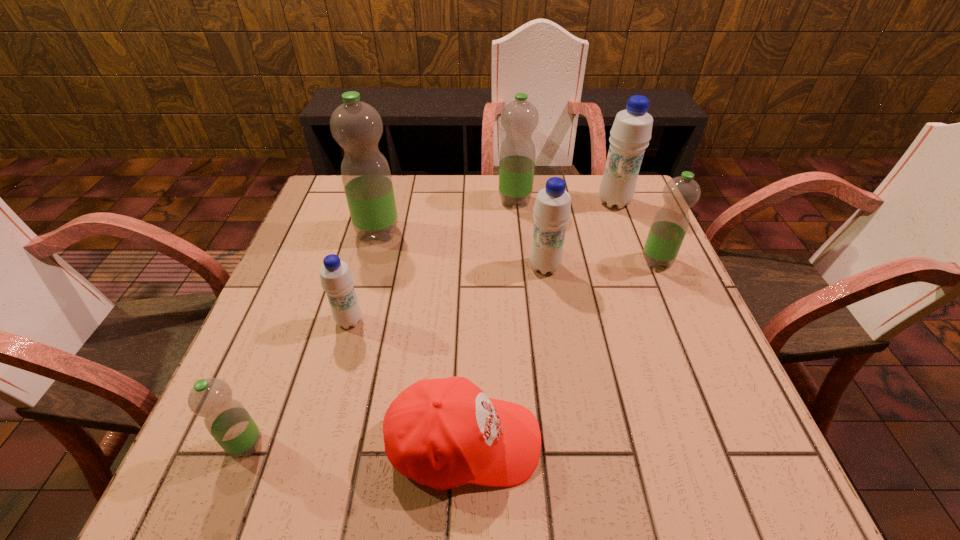
The image size is (960, 540). I want to click on vacant space that satisfies the following two spatial constraints: 1. on the front side of the third green water bottle from left to right; 2. on the front panel of the shortest object, so click(x=539, y=442).

Find the location of a particular element. This screenshot has width=960, height=540. free space that satisfies the following two spatial constraints: 1. on the back side of the biggest blue water bottle; 2. on the right side of the smallest blue water bottle is located at coordinates (382, 202).

Where is `vacant region that satisfies the following two spatial constraints: 1. on the front side of the biggest blue water bottle; 2. on the front panel of the baseball cap`? vacant region that satisfies the following two spatial constraints: 1. on the front side of the biggest blue water bottle; 2. on the front panel of the baseball cap is located at coordinates (706, 442).